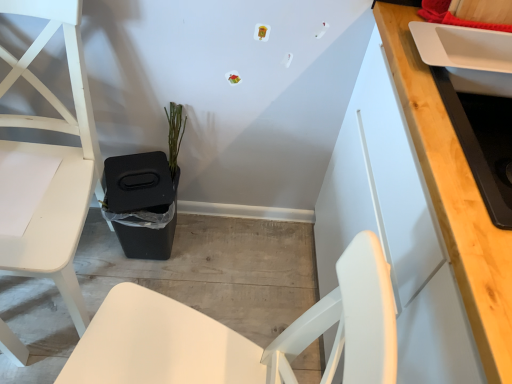
Image resolution: width=512 pixels, height=384 pixels. Find the location of `white matte chair at left`. white matte chair at left is located at coordinates (55, 155).

Describe the element at coordinates (55, 155) in the screenshot. The image size is (512, 384). I see `white matte chair at left` at that location.

Identify the location of green matte plant at center. (175, 134).

Measure the distance between white glossy sink at upper right and camera.

white glossy sink at upper right is 24.50 inches from camera.

The height and width of the screenshot is (384, 512). Find the location of `white matte chair at left`. white matte chair at left is located at coordinates (55, 155).

Can you see white matte chair at left touching white glossy sink at upper right?

No.

Based on the photo, can you tell me how much white matte chair at left and white glossy sink at upper right differ in facing direction?

They differ by 89.9 degrees in their facing directions.

Can you confirm if white matte chair at left is shorter than white glossy sink at upper right?

No.

Is white matte chair at left smaller than white glossy sink at upper right?

Incorrect, white matte chair at left is not smaller in size than white glossy sink at upper right.

Is white glossy sink at upper right not within white matte chair at left?

Absolutely, white glossy sink at upper right is external to white matte chair at left.

In the image, is white glossy sink at upper right on the left side or the right side of white matte chair at left?

In the image, white glossy sink at upper right appears on the right side of white matte chair at left.

Looking at this image, how different are the orientations of white glossy sink at upper right and white matte chair at left in degrees?

There is a 89.9-degree angle between the facing directions of white glossy sink at upper right and white matte chair at left.

Is white glossy sink at upper right oriented away from white matte chair at left?

No.

Is green matte plant at center touching white matte chair at left?

No, green matte plant at center is not beside white matte chair at left.

How different are the orientations of green matte plant at center and white matte chair at left in degrees?

The facing directions of green matte plant at center and white matte chair at left are 0.000326 degrees apart.

I want to click on plant beneath the white matte chair at left (from a real-world perspective), so pyautogui.click(x=175, y=134).

From the image's perspective, which is above, green matte plant at center or white matte chair at left?

From the image's view, green matte plant at center is above.

From the picture: Considering the relative sizes of white glossy sink at upper right and green matte plant at center in the image provided, is white glossy sink at upper right wider than green matte plant at center?

Yes, white glossy sink at upper right is wider than green matte plant at center.

Is white glossy sink at upper right placed right next to green matte plant at center?

No, white glossy sink at upper right is not touching green matte plant at center.

Which object is closer to the camera, white glossy sink at upper right or green matte plant at center?

white glossy sink at upper right is closer to the camera.

From the image's perspective, which is above, white glossy sink at upper right or green matte plant at center?

From the image's view, green matte plant at center is above.

Does green matte plant at center lie behind white glossy sink at upper right?

Yes, green matte plant at center is behind white glossy sink at upper right.

What's the angular difference between green matte plant at center and white glossy sink at upper right's facing directions?

They differ by 89.9 degrees in their facing directions.

Is green matte plant at center aimed at white glossy sink at upper right?

No, green matte plant at center is not turned towards white glossy sink at upper right.

Relative to green matte plant at center, is white matte chair at left in front or behind?

white matte chair at left is positioned closer to the viewer than green matte plant at center.

Based on the photo, can you confirm if white matte chair at left is thinner than green matte plant at center?

In fact, white matte chair at left might be wider than green matte plant at center.

Is white matte chair at left facing away from green matte plant at center?

No, white matte chair at left is not facing away from green matte plant at center.

Is white matte chair at left far from green matte plant at center?

They are positioned close to each other.

The width and height of the screenshot is (512, 384). In order to click on sink lying above the white matte chair at left (from the image's perspective) in this screenshot , I will do `click(483, 142)`.

You are a GUI agent. You are given a task and a screenshot of the screen. Output one action in this format:
    pyautogui.click(x=<x>, y=<y>)
    Task: Click on the sink located on the right of white matte chair at left
    The height and width of the screenshot is (384, 512).
    Given the screenshot: What is the action you would take?
    pyautogui.click(x=483, y=142)

Looking at the image, which one is located further to green matte plant at center, white matte chair at left or white glossy sink at upper right?

Based on the image, white glossy sink at upper right appears to be further to green matte plant at center.

From the image, which object appears to be farther from white glossy sink at upper right, green matte plant at center or white matte chair at left?

Based on the image, white matte chair at left appears to be further to white glossy sink at upper right.

Estimate the real-world distances between objects in this image. Which object is closer to white glossy sink at upper right, white matte chair at left or green matte plant at center?

green matte plant at center is closer to white glossy sink at upper right.

Estimate the real-world distances between objects in this image. Which object is closer to white matte chair at left, white glossy sink at upper right or green matte plant at center?

green matte plant at center.

Based on their spatial positions, is green matte plant at center or white glossy sink at upper right closer to white matte chair at left?

green matte plant at center is positioned closer to the anchor white matte chair at left.

Which object lies nearer to the anchor point green matte plant at center, white glossy sink at upper right or white matte chair at left?

white matte chair at left is positioned closer to the anchor green matte plant at center.

Locate an element on the screen. plant between white matte chair at left and white glossy sink at upper right is located at coordinates (175, 134).